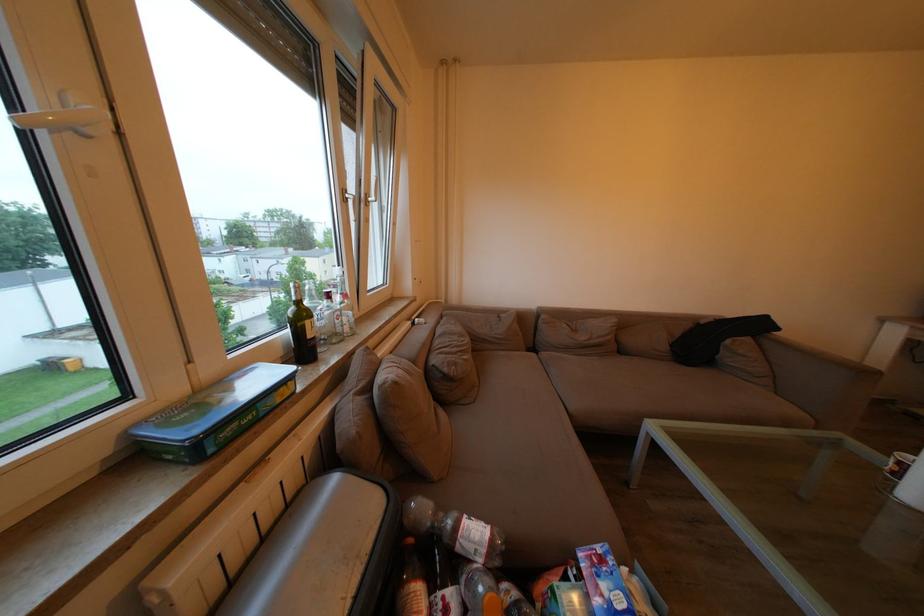
The width and height of the screenshot is (924, 616). What are the coordinates of `orange cap bottle` in the screenshot? It's located at (410, 583).